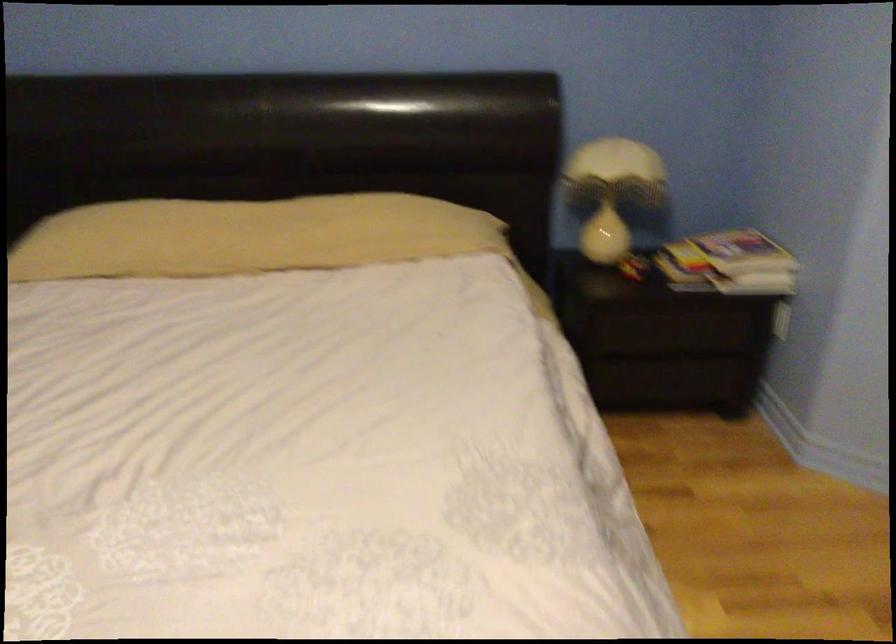
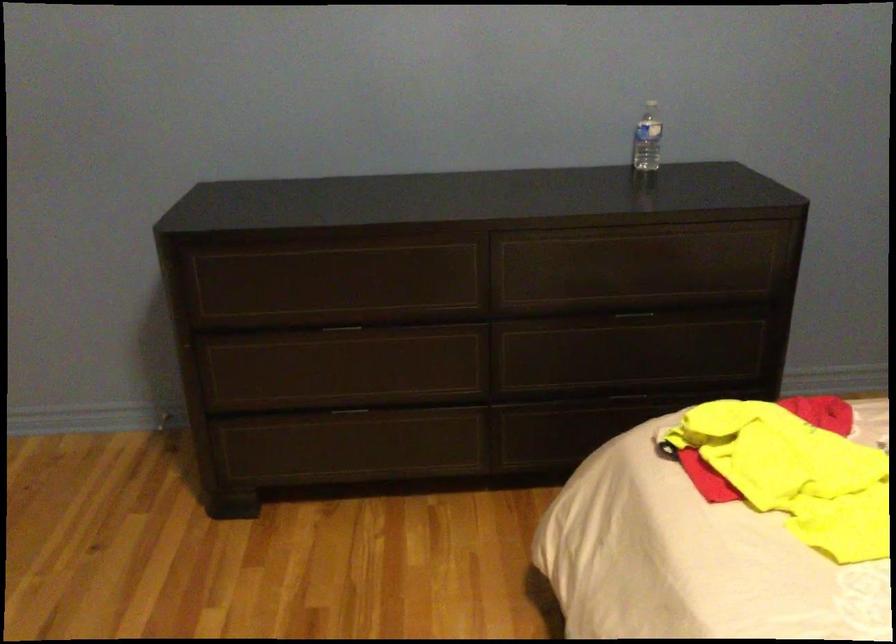
First-person continuous shooting, in which direction is the camera rotating?

The camera rotated toward left-down.